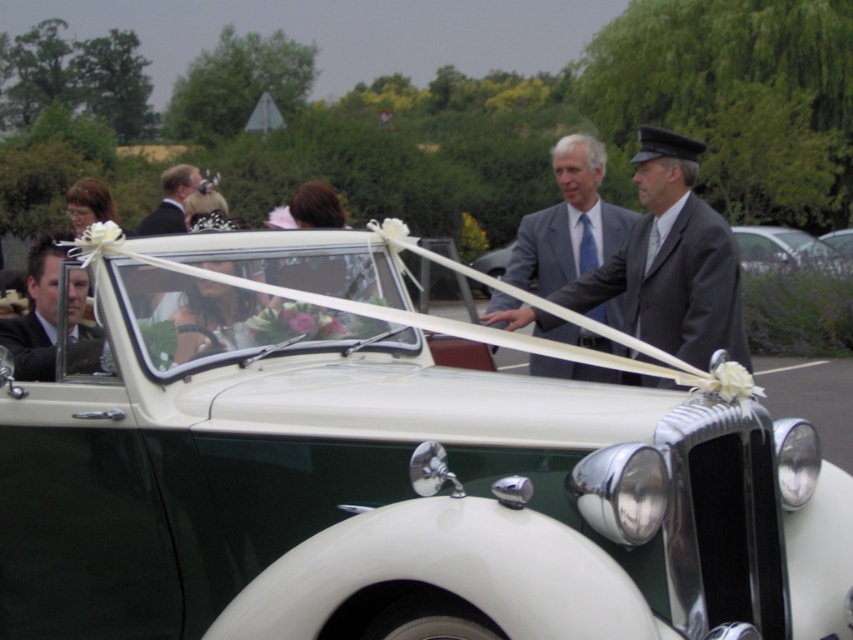
Question: Which of the following is the closest to the observer?

Choices:
 (A) matte gray suit at center
 (B) matte black suit at center

Answer: (A)

Question: Does white glossy convertible at center come behind matte black suit at center?

Choices:
 (A) yes
 (B) no

Answer: (B)

Question: Which object is the farthest from the white glossy convertible at center?

Choices:
 (A) matte gray suit at center
 (B) matte black suit at left

Answer: (A)

Question: Is matte gray suit at center below matte black suit at left?

Choices:
 (A) yes
 (B) no

Answer: (B)

Question: Is matte black suit at left positioned at the back of matte black suit at center?

Choices:
 (A) no
 (B) yes

Answer: (A)

Question: Which point is farther to the camera?

Choices:
 (A) coord(415,408)
 (B) coord(532,252)
 (C) coord(161,209)

Answer: (C)